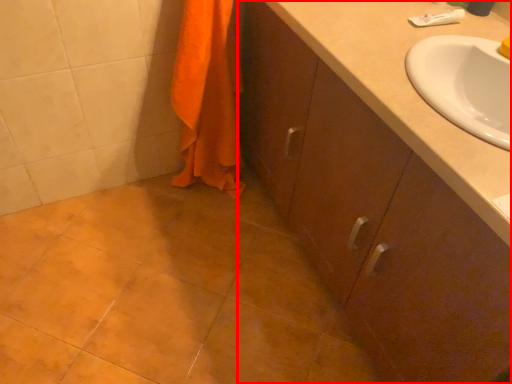
Question: From the image's perspective, considering the relative positions of bathroom cabinet (annotated by the red box) and bath towel in the image provided, where is bathroom cabinet (annotated by the red box) located with respect to the staircase?

Choices:
 (A) below
 (B) above

Answer: (A)